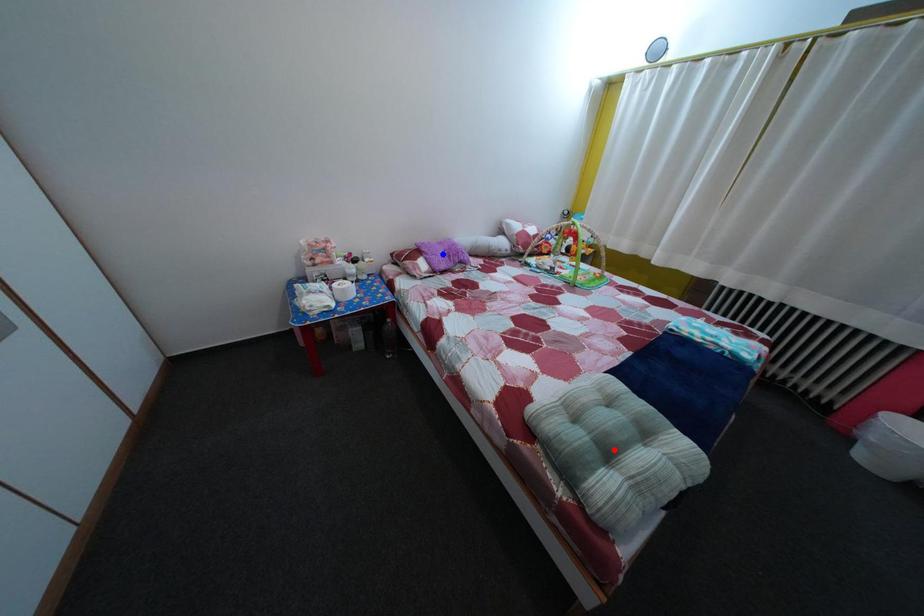
Question: Two points are marked on the image. Which point is closer to the camera?

Choices:
 (A) Blue point is closer.
 (B) Red point is closer.

Answer: (B)